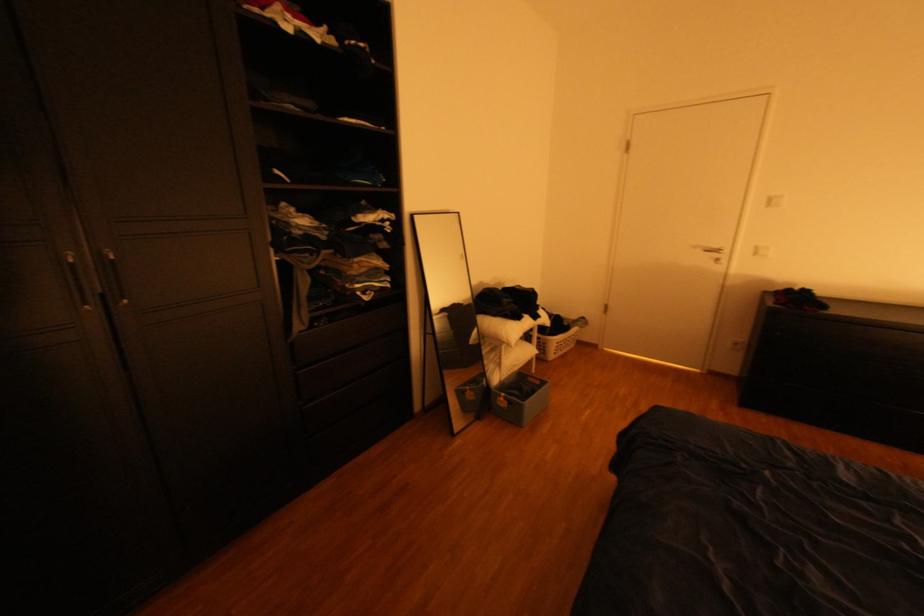
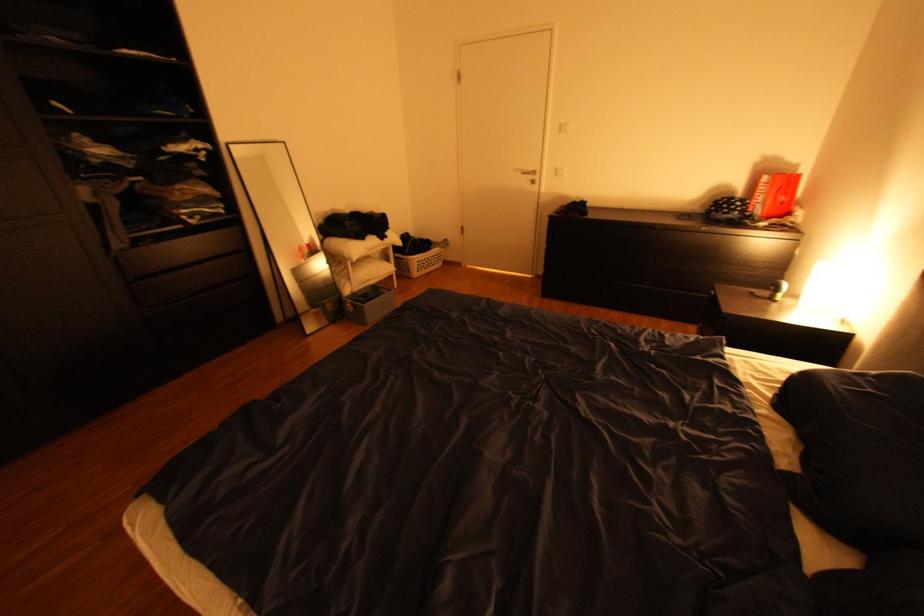
The point at (714,371) is marked in the first image. Where is the corresponding point in the second image?

(543, 276)